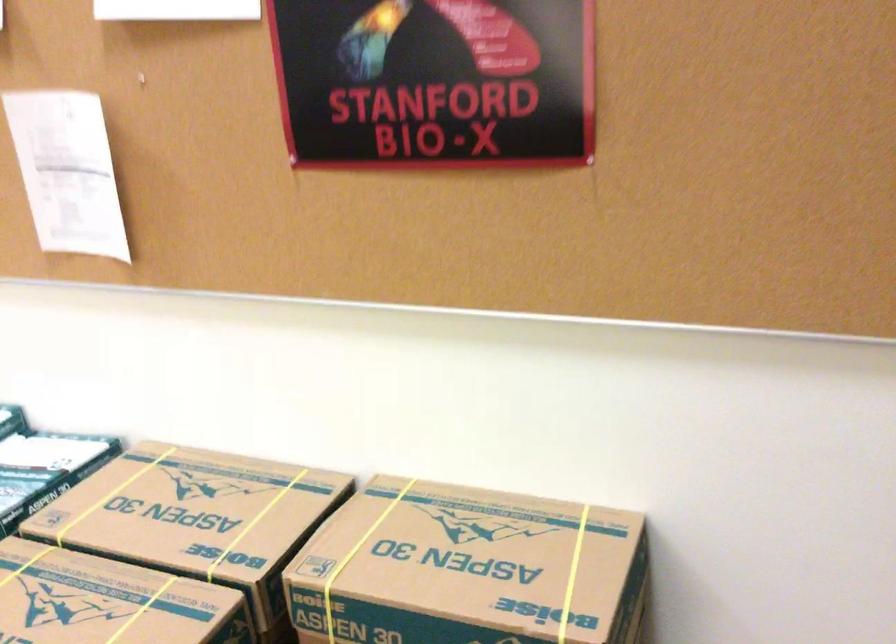
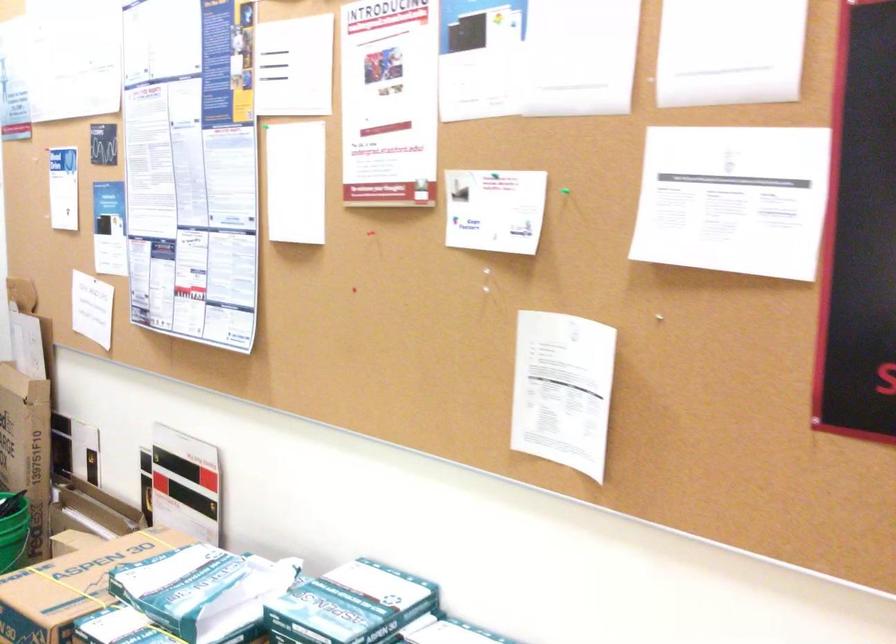
Question: How did the camera likely rotate?

Choices:
 (A) Left
 (B) Right
 (C) Up
 (D) Down

Answer: (A)